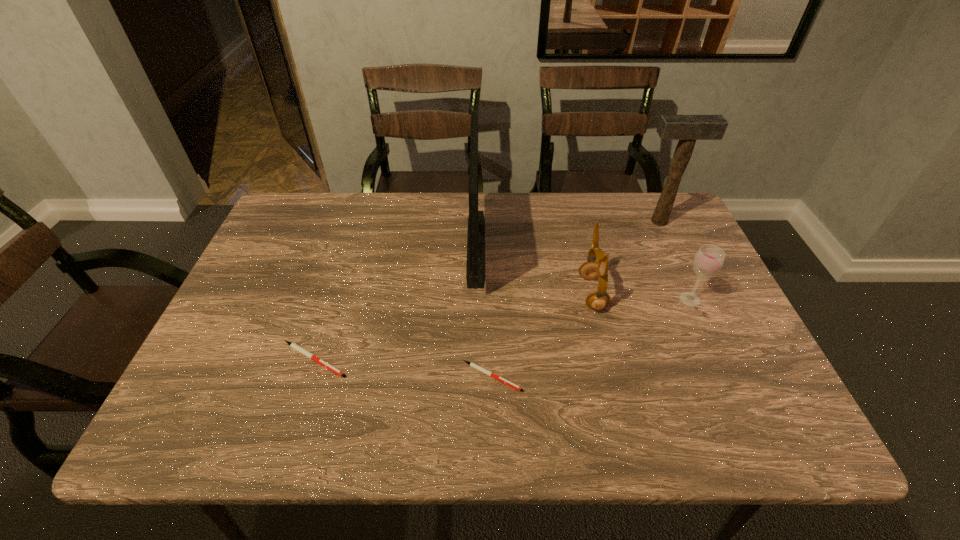
What are the coordinates of `free spot that satisfies the following two spatial constraints: 1. on the front-facing side of the earphone; 2. on the right side of the wineglass` in the screenshot? It's located at (593, 299).

Find the location of a particular element. free location that satisfies the following two spatial constraints: 1. on the front side of the mallet; 2. on the clicker of the fifth tallest object is located at coordinates (723, 360).

What are the coordinates of `vacant area in the image that satisfies the following two spatial constraints: 1. on the front-facing side of the monitor; 2. on the left side of the third shortest object` in the screenshot? It's located at (475, 299).

What are the coordinates of `free location that satisfies the following two spatial constraints: 1. on the front side of the wineglass; 2. on the clicker of the shortest object` in the screenshot? It's located at (725, 376).